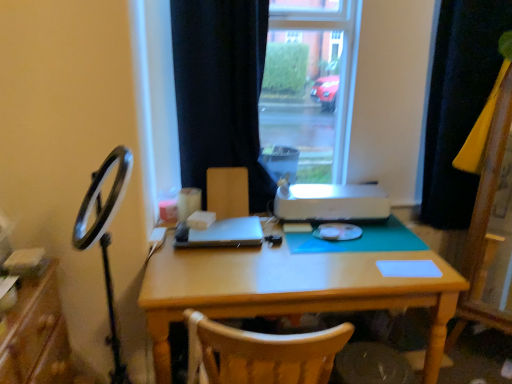
Question: Is point (362, 200) positioned closer to the camera than point (494, 62)?

Choices:
 (A) farther
 (B) closer

Answer: (A)

Question: Do you think white plastic printer at center is within black fabric curtain at right, arranged as the second curtain when viewed from the left, or outside of it?

Choices:
 (A) inside
 (B) outside

Answer: (B)

Question: Estimate the real-world distances between objects in this image. Which object is farther from the black fabric curtain at right, arranged as the second curtain when viewed from the left?

Choices:
 (A) black fabric curtain at center, which is the 2th curtain in right-to-left order
 (B) wooden chair at center
 (C) satin black laptop at center
 (D) white matte notepad at center
 (E) white plastic printer at center

Answer: (C)

Question: Estimate the real-world distances between objects in this image. Which object is farther from the white plastic printer at center?

Choices:
 (A) white matte notepad at center
 (B) satin black laptop at center
 (C) wooden desk at center
 (D) black fabric curtain at right, arranged as the second curtain when viewed from the left
 (E) black fabric curtain at center, which is the 2th curtain in right-to-left order

Answer: (D)